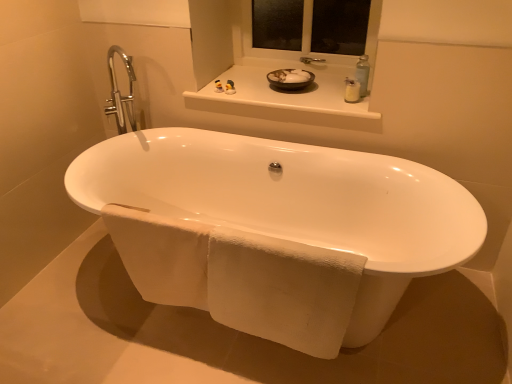
Identify the location of vacant space situated on the left part of white plastic soap dispenser at upper right, the second toiletry in the back-to-front sequence. (319, 104).